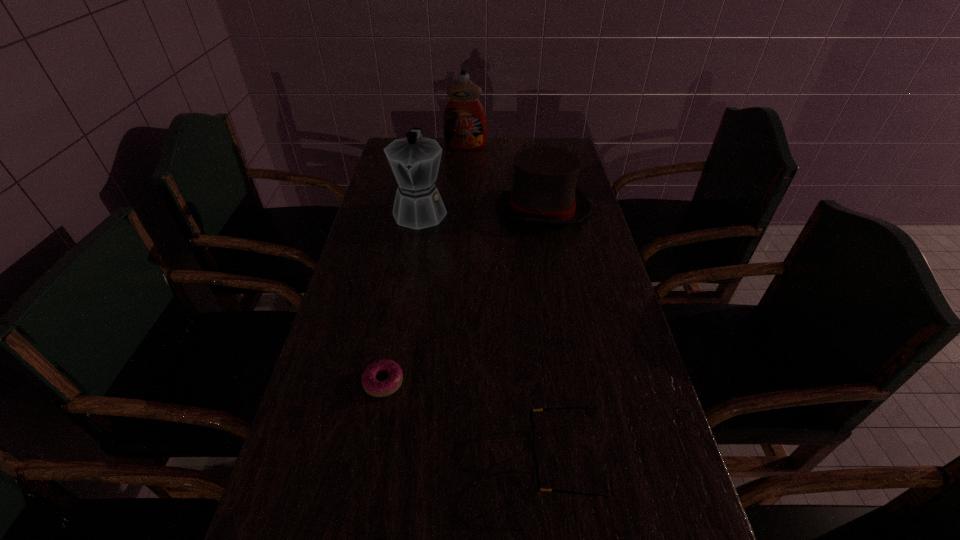
Identify the location of the farthest object. Image resolution: width=960 pixels, height=540 pixels. (464, 123).

Identify the location of coffeepot. The height and width of the screenshot is (540, 960). (415, 160).

Where is `dress hat`? Image resolution: width=960 pixels, height=540 pixels. dress hat is located at coordinates (544, 190).

Locate an element on the screen. The height and width of the screenshot is (540, 960). the fourth tallest object is located at coordinates (535, 469).

You are a GUI agent. You are given a task and a screenshot of the screen. Output one action in this format:
    pyautogui.click(x=<x>, y=<y>)
    Task: Click on the nearest object
    Image resolution: width=960 pixels, height=540 pixels.
    Given the screenshot: What is the action you would take?
    pyautogui.click(x=535, y=469)

The image size is (960, 540). In order to click on the second nearest object in this screenshot , I will do `click(374, 387)`.

In order to click on doughnut in this screenshot , I will do `click(374, 387)`.

The width and height of the screenshot is (960, 540). I want to click on vacant area situated 0.380m on the front surface of the detergent, so pos(463,205).

Where is `vacant space located at the spout of the coffeepot`? The height and width of the screenshot is (540, 960). vacant space located at the spout of the coffeepot is located at coordinates (411, 264).

Where is `vacant space situated 0.110m on the front of the third tallest object`? vacant space situated 0.110m on the front of the third tallest object is located at coordinates (551, 256).